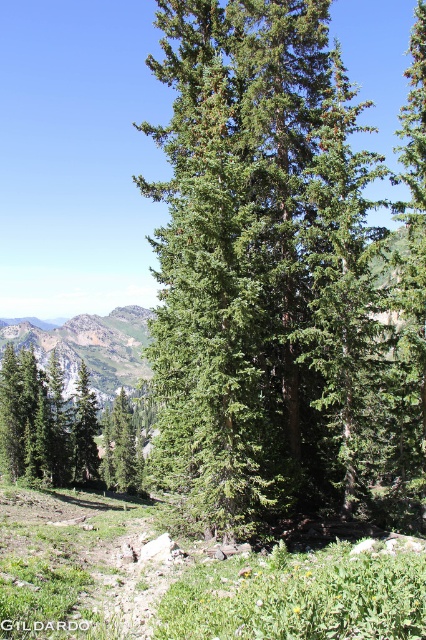
Is the position of green needle-like at center more distant than that of green leafy mountain at center?

That is False.

Between point (233, 461) and point (42, 358), which one is positioned behind?

The point (42, 358) is more distant.

At what (x,y) coordinates should I click in order to perform the action: click on green needle-like at center. Please return your answer as a coordinate pair (x, y). The image size is (426, 640). Looking at the image, I should click on (259, 266).

Which is in front, point (23, 452) or point (106, 321)?

Point (23, 452)

Does green matte tree at lower left come in front of green leafy mountain at center?

Yes, it is.

Image resolution: width=426 pixels, height=640 pixels. Identify the location of green matte tree at lower left. (46, 422).

Who is shorter, green needle-like at center or green matte tree at lower left?

green matte tree at lower left

Find the location of a particular element. This screenshot has height=640, width=426. green needle-like at center is located at coordinates (259, 266).

In order to click on green needle-like at center in this screenshot , I will do `click(259, 266)`.